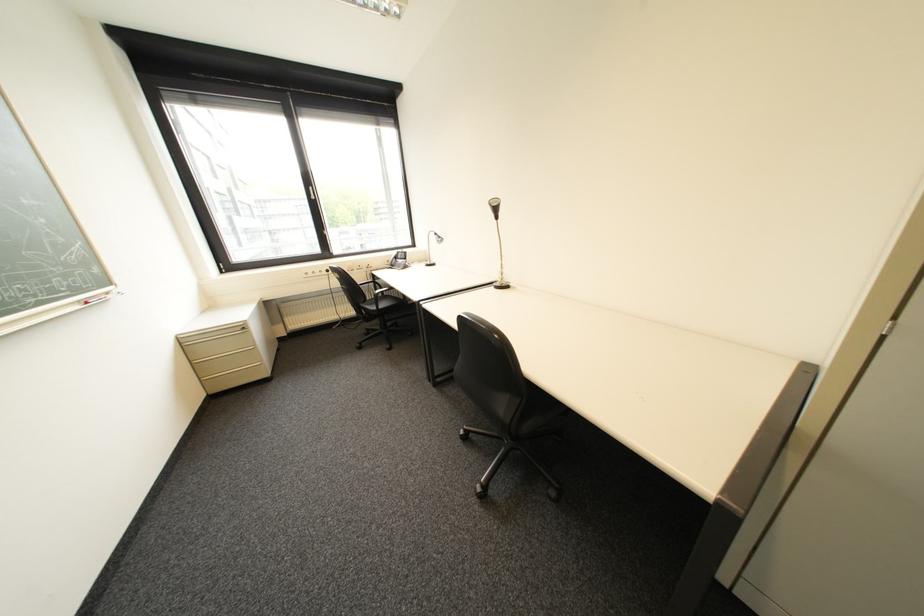
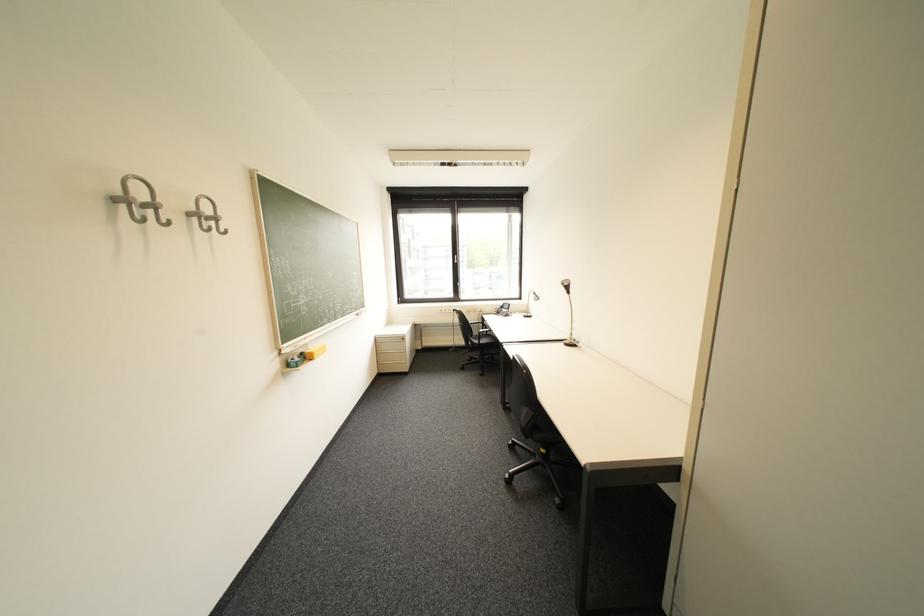
Find the pixel in the second image that matches point 419,244 in the first image.

(528, 297)